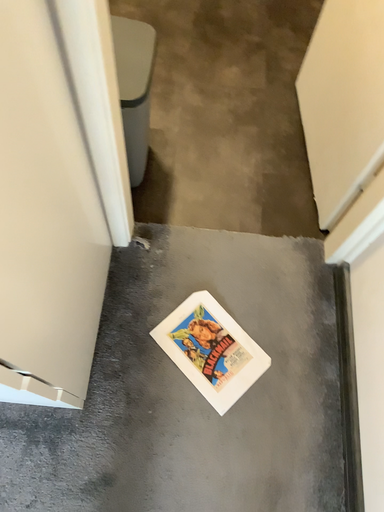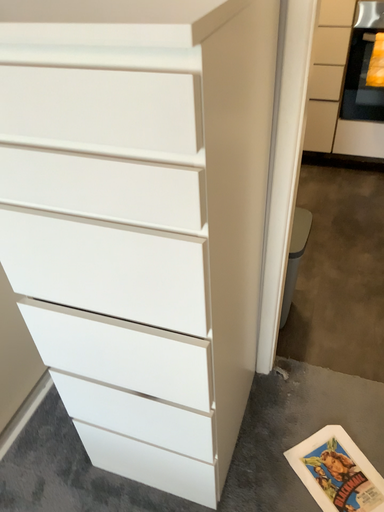
Question: How did the camera likely rotate when shooting the video?

Choices:
 (A) rotated left
 (B) rotated right

Answer: (A)